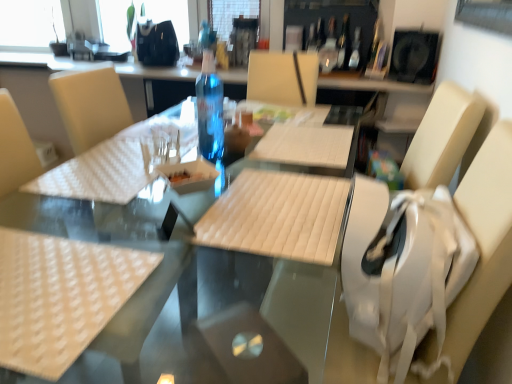
Find the location of a particular element. free space above white quilted fabric at center (from a real-world perspective) is located at coordinates (282, 204).